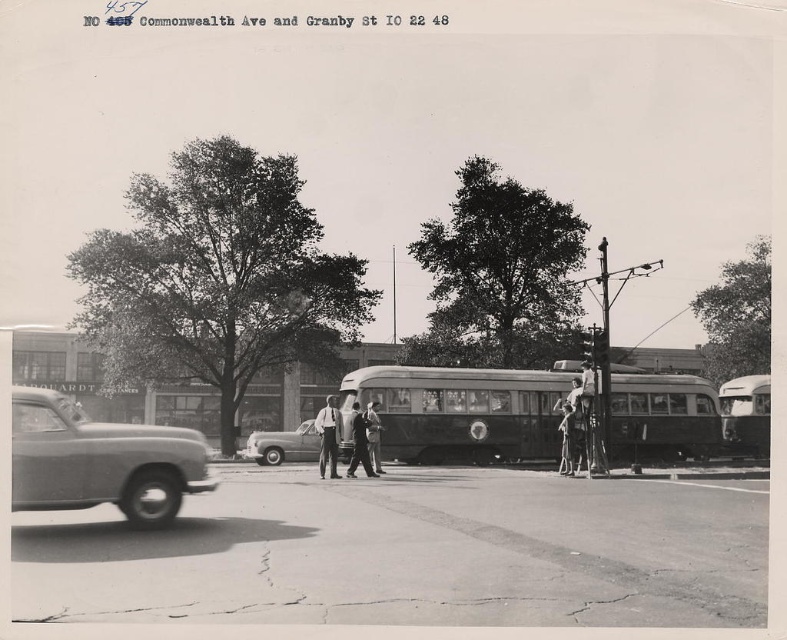
Is matte gray car at left smaller than smooth gray suit at center?

Actually, matte gray car at left might be larger than smooth gray suit at center.

Measure the distance between matte gray car at left and camera.

matte gray car at left and camera are 9.38 meters apart from each other.

Where is `matte gray car at left`? Image resolution: width=787 pixels, height=640 pixels. matte gray car at left is located at coordinates (102, 460).

Is dark suit at center to the left of smooth gray suit at center from the viewer's perspective?

Indeed, dark suit at center is positioned on the left side of smooth gray suit at center.

Who is more forward, (x=366, y=440) or (x=368, y=429)?

Point (x=366, y=440)

Describe the element at coordinates (359, 442) in the screenshot. I see `dark suit at center` at that location.

This screenshot has height=640, width=787. What are the coordinates of `dark suit at center` in the screenshot? It's located at (359, 442).

Which of these two, metallic silver bus at right or smooth leather jacket at center, stands taller?

Standing taller between the two is smooth leather jacket at center.

Is point (743, 435) in front of point (575, 452)?

No, it is behind (575, 452).

Is point (747, 445) farther from camera compared to point (586, 433)?

Yes, it is.

I want to click on metallic silver bus at right, so click(745, 413).